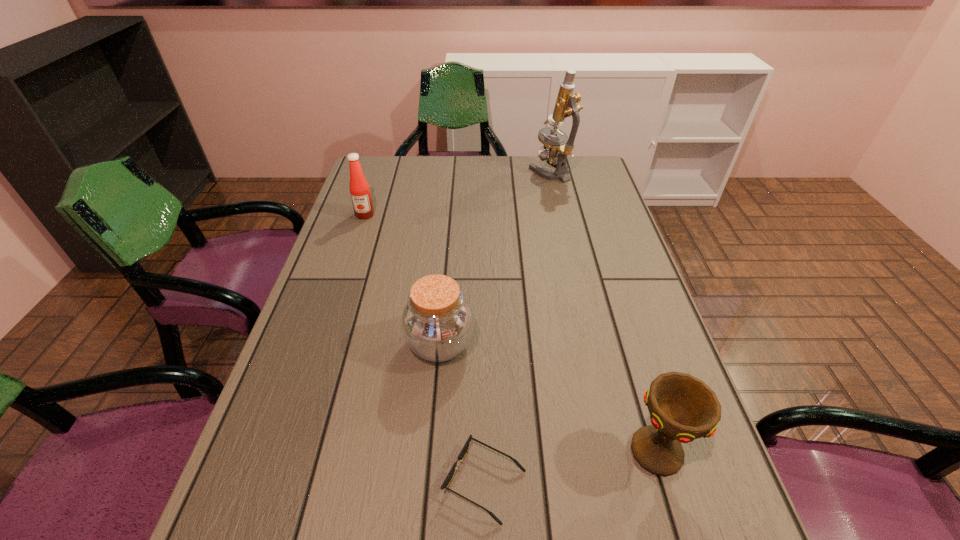
This screenshot has height=540, width=960. I want to click on free spot that satisfies the following two spatial constraints: 1. on the front-facing side of the jar; 2. on the left side of the leftmost object, so click(x=323, y=344).